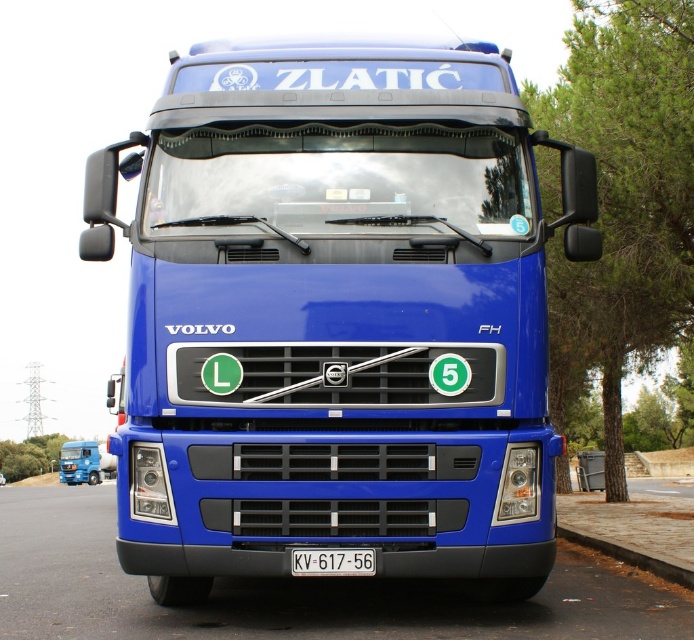
Who is positioned more to the right, blue metallic truck at center or paved concrete curb at lower right?

From the viewer's perspective, paved concrete curb at lower right appears more on the right side.

Is point (160, 305) farther from viewer compared to point (677, 570)?

No, it is in front of (677, 570).

Between point (217, 276) and point (648, 561), which one is positioned in front?

Point (217, 276) is in front.

Locate an element on the screen. This screenshot has width=694, height=640. blue metallic truck at center is located at coordinates (337, 316).

Find the location of a particular element. This screenshot has height=640, width=694. paved concrete curb at lower right is located at coordinates (632, 554).

Does paved concrete curb at lower right have a lesser height compared to metallic blue truck at lower left?

Yes, paved concrete curb at lower right is shorter than metallic blue truck at lower left.

What do you see at coordinates (632, 554) in the screenshot? Image resolution: width=694 pixels, height=640 pixels. I see `paved concrete curb at lower right` at bounding box center [632, 554].

Where is `paved concrete curb at lower right`? The image size is (694, 640). paved concrete curb at lower right is located at coordinates 632,554.